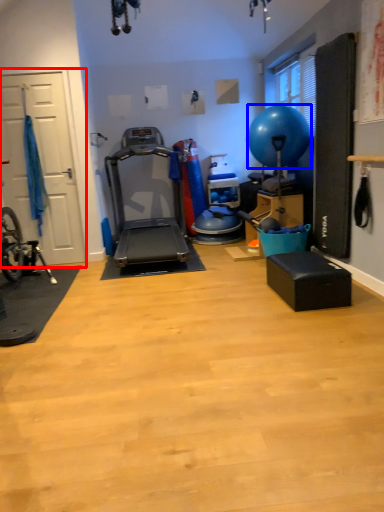
Question: Which of the following is the closest to the observer, garage door (highlighted by a red box) or balloon (highlighted by a blue box)?

Choices:
 (A) garage door
 (B) balloon

Answer: (B)